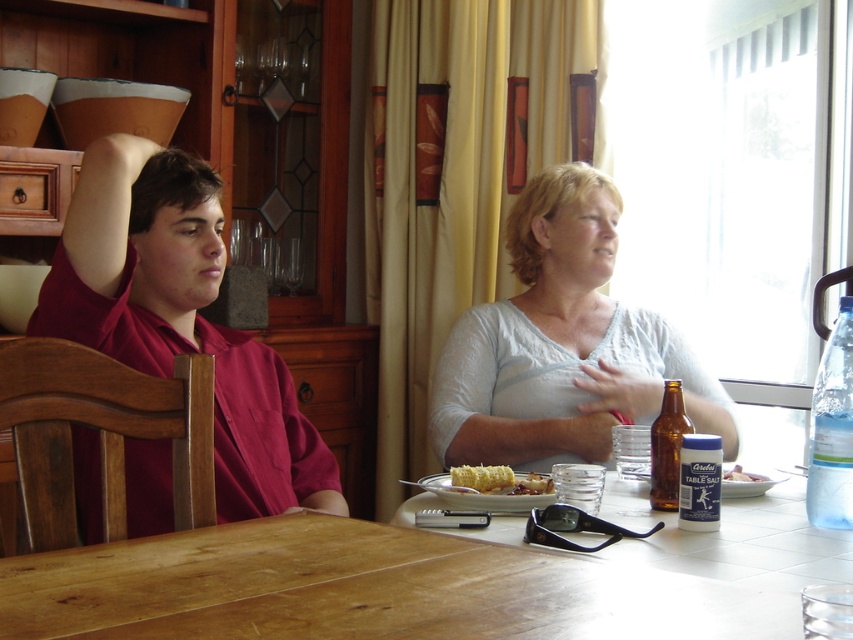
Can you confirm if wooden table at center is shorter than white lace shirt at center?

Correct, wooden table at center is not as tall as white lace shirt at center.

Measure the distance between wooden table at center and white lace shirt at center.

The distance of wooden table at center from white lace shirt at center is 3.54 feet.

Who is more distant from viewer, (497, 616) or (502, 408)?

Positioned behind is point (502, 408).

Locate an element on the screen. This screenshot has height=640, width=853. wooden table at center is located at coordinates (434, 579).

Which is more to the left, matte red shirt at left or brown glass bottle at table right?

matte red shirt at left

Is point (195, 237) farther from camera compared to point (670, 496)?

Yes.

This screenshot has width=853, height=640. Find the location of `matte red shirt at left`. matte red shirt at left is located at coordinates (180, 317).

Between point (750, 502) and point (479, 506), which one is positioned behind?

The point (750, 502) is more distant.

Which of these two, wooden table at center or yellow matte corn at center, stands shorter?

wooden table at center

Locate an element on the screen. Image resolution: width=853 pixels, height=640 pixels. wooden table at center is located at coordinates (434, 579).